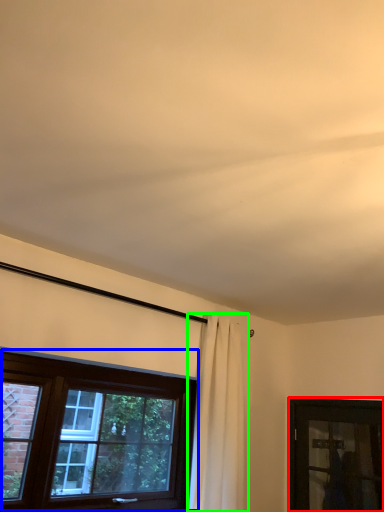
Question: Which object is positioned farthest from window (highlighted by a red box)? Select from window (highlighted by a blue box) and curtain (highlighted by a green box).

Choices:
 (A) window
 (B) curtain

Answer: (A)